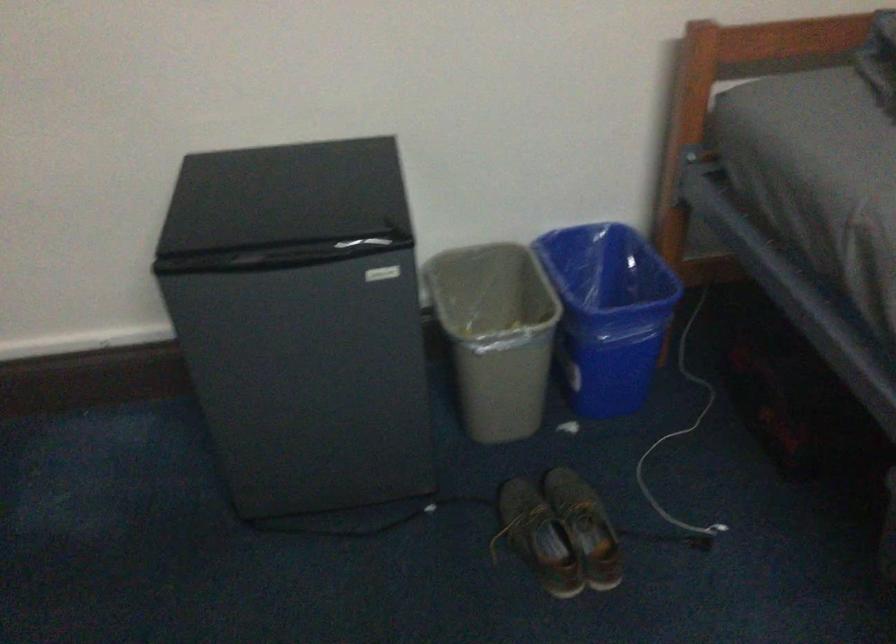
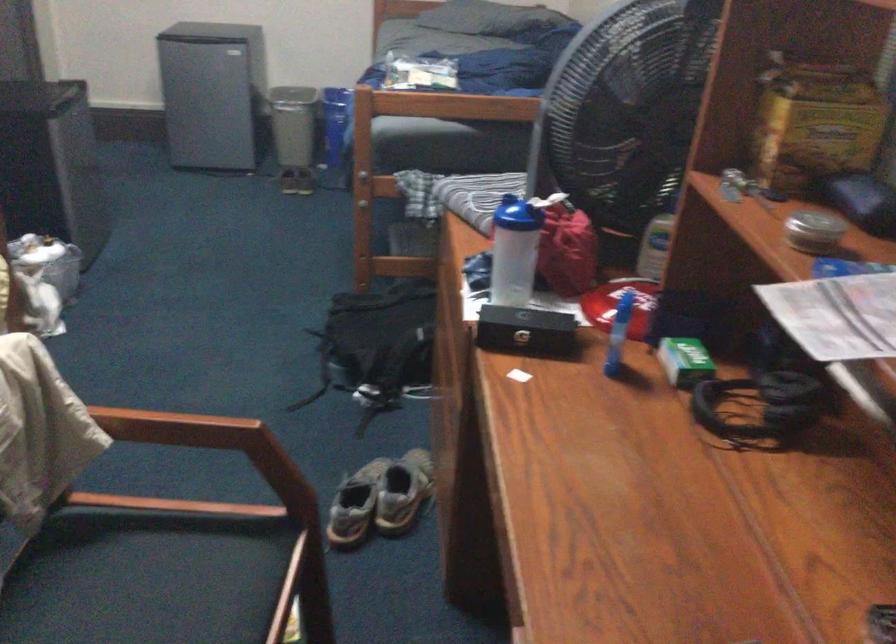
Find the pixel in the second image that matches [596,474] in the first image.

(293, 124)